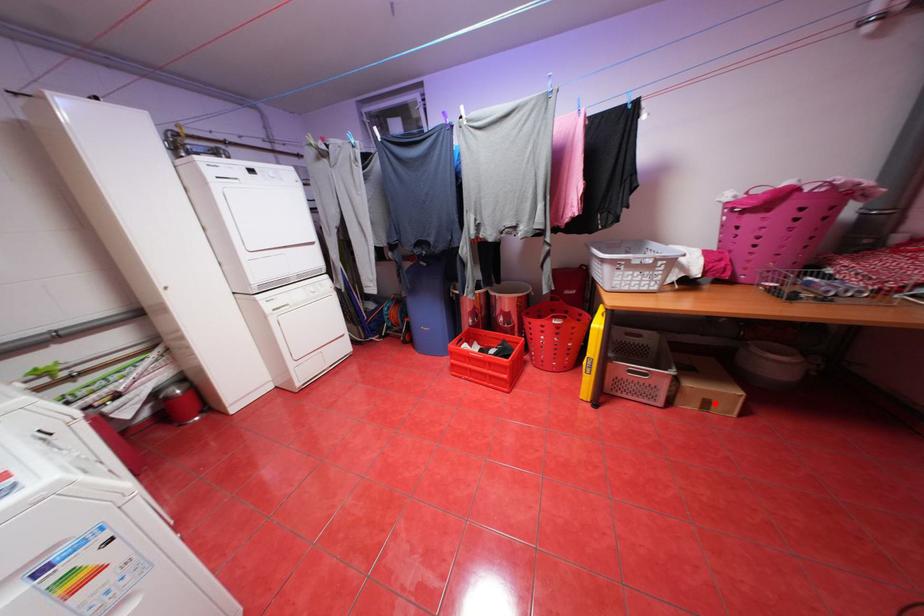
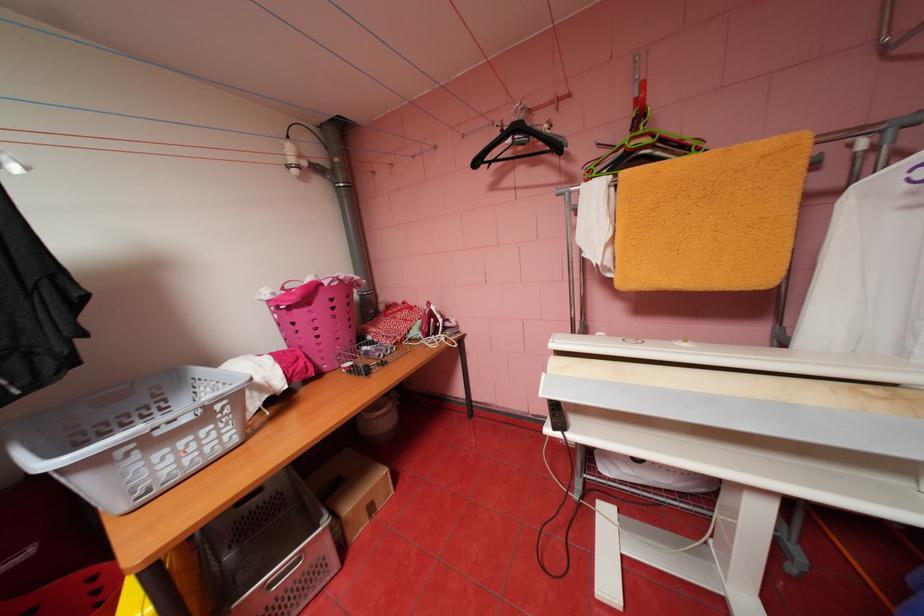
Question: I am providing you with two images of the same scene from different viewpoints. A red point is marked on the first image. At the location where the point appears in image 1, is it still visible in image 2?

Choices:
 (A) Yes
 (B) No

Answer: (A)